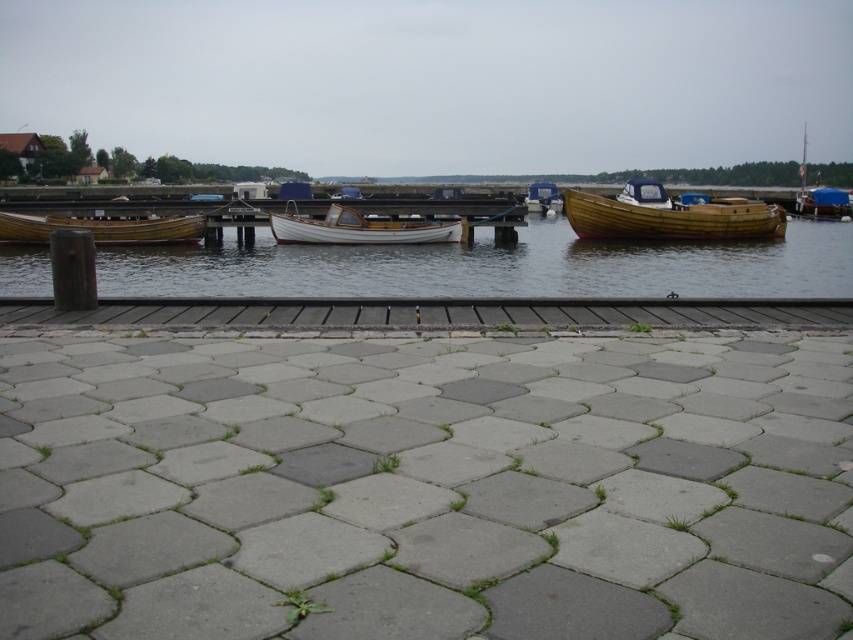
Question: Observing the image, what is the correct spatial positioning of wooden boats at center in reference to smooth wooden dock at center?

Choices:
 (A) left
 (B) right

Answer: (B)

Question: Among these objects, which one is farthest from the camera?

Choices:
 (A) wooden boat at left
 (B) white wood boat at center
 (C) wooden boat at center

Answer: (C)

Question: Which of these objects is positioned farthest from the matte blue boat at center?

Choices:
 (A) wooden boat at left
 (B) gray concrete pavement at center

Answer: (B)

Question: Which object is the closest to the wooden boat at right?

Choices:
 (A) wooden boats at center
 (B) matte blue boat at center

Answer: (B)

Question: In this image, where is wooden boat at left located relative to matte blue boat at center?

Choices:
 (A) below
 (B) above

Answer: (A)

Question: Observing the image, what is the correct spatial positioning of wooden boats at center in reference to white wood boat at center?

Choices:
 (A) below
 (B) above

Answer: (B)